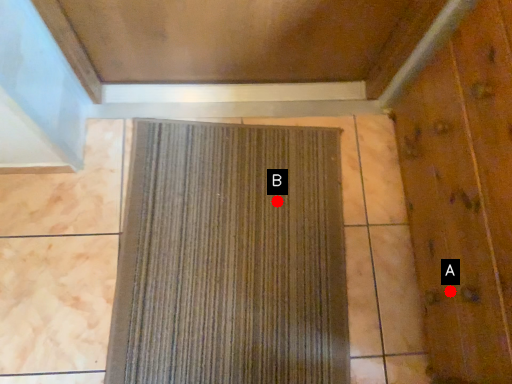
Question: Two points are circled on the image, labeled by A and B beside each circle. Among these points, which one is farthest from the camera?

Choices:
 (A) A is further
 (B) B is further

Answer: (B)